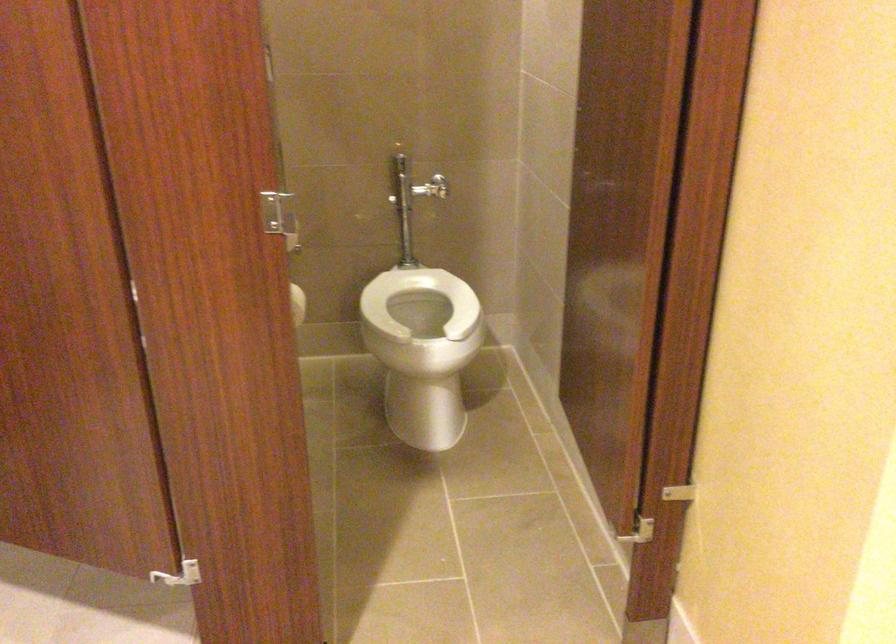
What do you see at coordinates (400, 180) in the screenshot? I see `a toilet flush lever` at bounding box center [400, 180].